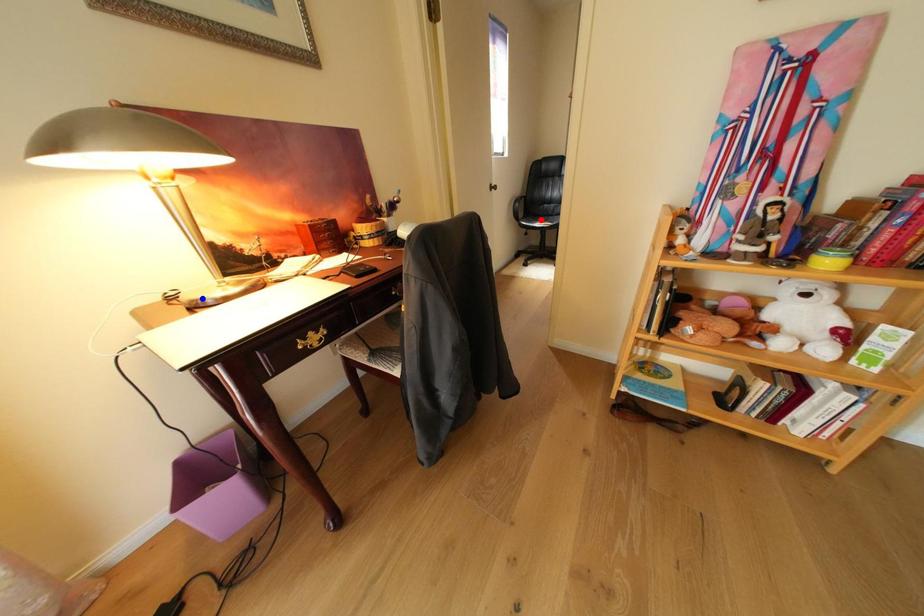
Question: Which of the two points in the image is closer to the camera?

Choices:
 (A) Blue point is closer.
 (B) Red point is closer.

Answer: (A)